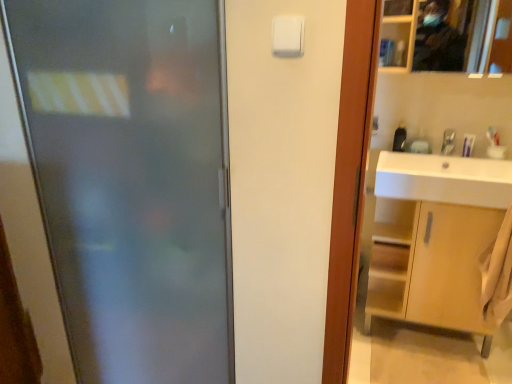
Question: From the image's perspective, is silver metallic faucet at upper right above or below white plastic light switch at upper center?

Choices:
 (A) above
 (B) below

Answer: (B)

Question: Considering the positions of point (454, 140) and point (297, 41), is point (454, 140) closer or farther from the camera than point (297, 41)?

Choices:
 (A) closer
 (B) farther

Answer: (B)

Question: Based on their relative distances, which object is nearer to the silver metallic faucet at upper right?

Choices:
 (A) frosted glass door at left
 (B) light brown wood cabinet at right
 (C) metallic reflective mirror at upper right
 (D) white plastic light switch at upper center
 (E) white glossy sink at right

Answer: (E)

Question: Estimate the real-world distances between objects in this image. Which object is closer to the light brown wood cabinet at right?

Choices:
 (A) frosted glass door at left
 (B) white plastic light switch at upper center
 (C) white glossy sink at right
 (D) metallic reflective mirror at upper right
 (E) silver metallic faucet at upper right

Answer: (C)